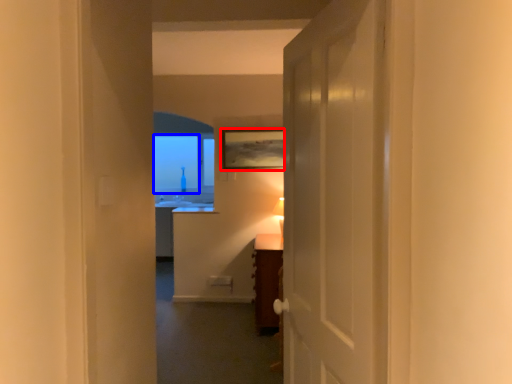
Question: Which of the following is the closest to the observer, picture frame (highlighted by a red box) or window screen (highlighted by a blue box)?

Choices:
 (A) picture frame
 (B) window screen

Answer: (A)